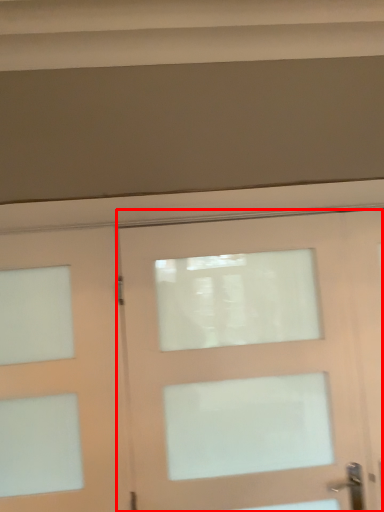
Question: From the image's perspective, where is door (annotated by the red box) located in relation to door in the image?

Choices:
 (A) below
 (B) above

Answer: (A)